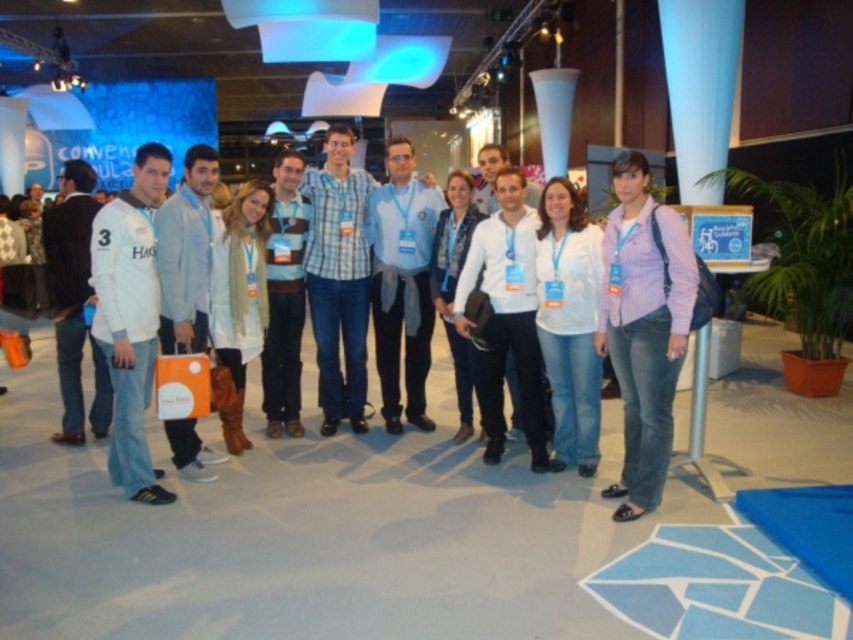
Question: Which point appears farthest from the camera in this image?

Choices:
 (A) (262, 470)
 (B) (607, 284)

Answer: (A)

Question: Which of the following is the farthest from the observer?

Choices:
 (A) (645, 289)
 (B) (387, 445)

Answer: (B)

Question: Is striped cotton shirt at center in front of white cotton shirt at center?

Choices:
 (A) no
 (B) yes

Answer: (B)

Question: Considering the relative positions of striped cotton shirt at center and white cotton shirt at center in the image provided, where is striped cotton shirt at center located with respect to white cotton shirt at center?

Choices:
 (A) right
 (B) left

Answer: (A)

Question: Is striped cotton shirt at center closer to the viewer compared to white cotton shirt at center?

Choices:
 (A) yes
 (B) no

Answer: (A)